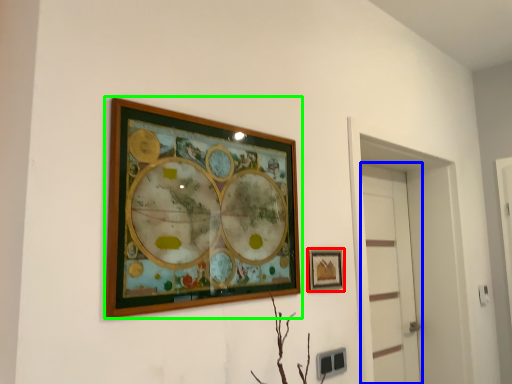
Question: Which object is the closest to the picture frame (highlighted by a red box)? Choose among these: door (highlighted by a blue box) or picture frame (highlighted by a green box).

Choices:
 (A) door
 (B) picture frame

Answer: (B)